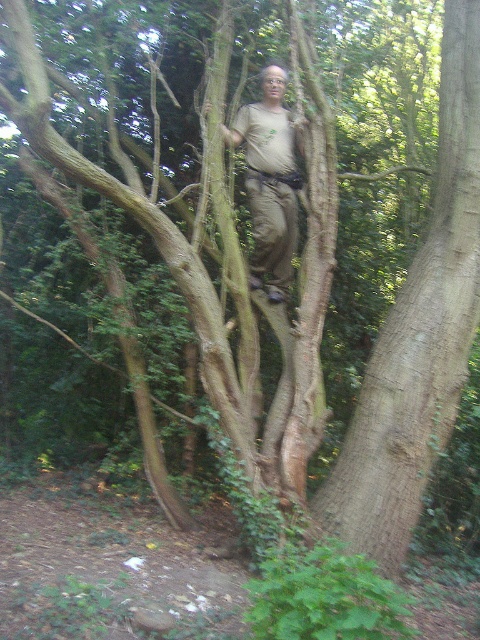
Question: Can you confirm if brown rough tree trunk at center is positioned below light brown fabric shirt at center?

Choices:
 (A) no
 (B) yes

Answer: (B)

Question: Does brown rough tree trunk at center have a smaller size compared to light brown fabric shirt at center?

Choices:
 (A) yes
 (B) no

Answer: (B)

Question: Which point is farther to the camera?

Choices:
 (A) brown rough tree trunk at center
 (B) light brown fabric shirt at center

Answer: (B)

Question: Which object is closer to the camera taking this photo?

Choices:
 (A) light brown fabric shirt at center
 (B) brown rough tree trunk at center

Answer: (B)

Question: Is brown rough tree trunk at center positioned behind light brown fabric shirt at center?

Choices:
 (A) yes
 (B) no

Answer: (B)